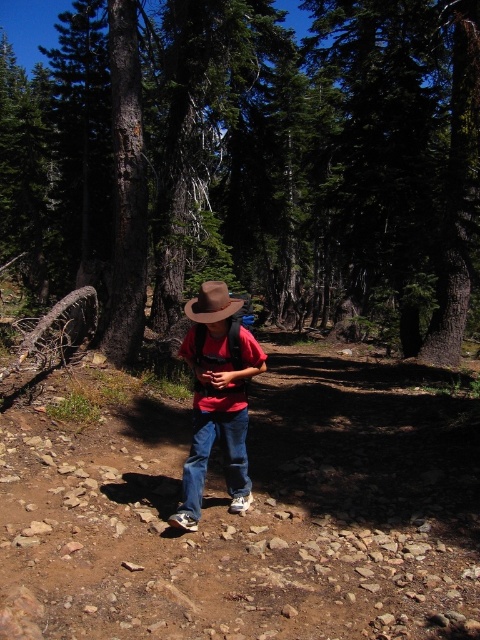
You are a photographer aiming to capture the brown bark tree at center and the brown felt cowboy hat at center in a single shot. Which object should you focus on first to ensure both are in focus?

You should focus on the brown felt cowboy hat at center first because it is closer to you than the brown bark tree at center, ensuring both will be in focus when using depth of field appropriately.

You are a hiker who wants to place a small marker at point (217, 397). The marker needs to be placed on the red shirt at center. Will the marker be visible on the red shirt at center?

Yes, the marker will be visible on the red shirt at center because point (217, 397) is on the matte red shirt at center.

You are a hiker trying to navigate through the forest. You see a point marked at coordinates (x=252, y=161). What object does this point correspond to?

The point at coordinates (x=252, y=161) corresponds to the brown bark tree at center.